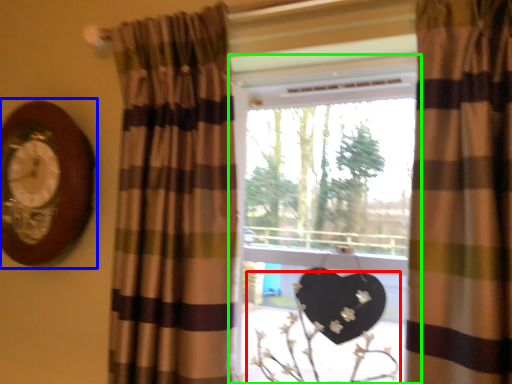
Question: Considering the real-world distances, which object is closest to floral arrangement (highlighted by a red box)? clock (highlighted by a blue box) or window (highlighted by a green box).

Choices:
 (A) clock
 (B) window

Answer: (B)